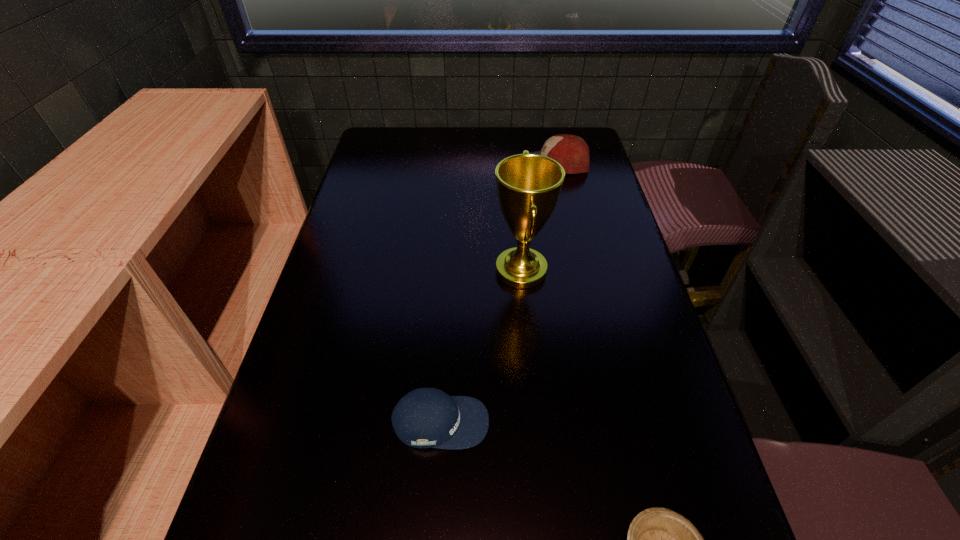
Image resolution: width=960 pixels, height=540 pixels. Find the location of `free space at the far right corner`. free space at the far right corner is located at coordinates (589, 128).

The height and width of the screenshot is (540, 960). In order to click on vacant area between the shorter baseball cap and the third shortest object in this screenshot , I will do `click(497, 293)`.

Find the location of a particular element. The width and height of the screenshot is (960, 540). free area in between the left baseball cap and the taller baseball cap is located at coordinates (497, 293).

Image resolution: width=960 pixels, height=540 pixels. I want to click on blank region between the left baseball cap and the third shortest object, so click(x=497, y=293).

Where is `vacant area that lies between the second shortest object and the second farthest object`? The image size is (960, 540). vacant area that lies between the second shortest object and the second farthest object is located at coordinates (481, 346).

The image size is (960, 540). What are the coordinates of `free space that is in between the farther baseball cap and the leftmost object` in the screenshot? It's located at (497, 293).

Where is `vacant point located between the right baseball cap and the nearer baseball cap`? vacant point located between the right baseball cap and the nearer baseball cap is located at coordinates (497, 293).

Find the location of a particular element. This screenshot has height=540, width=960. the closest object to the farther baseball cap is located at coordinates (528, 185).

Where is `object that stands as the closest to the second farthest object`? object that stands as the closest to the second farthest object is located at coordinates (425, 417).